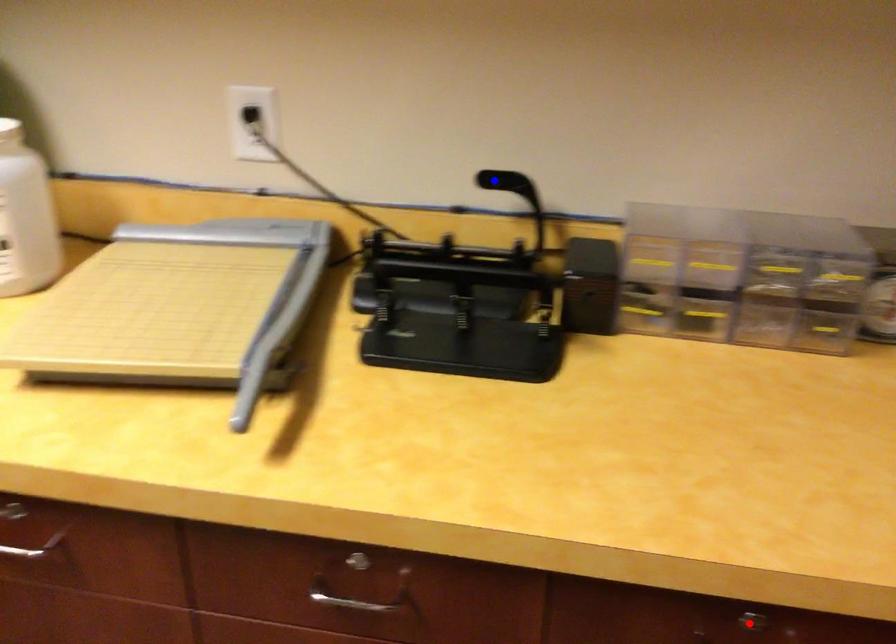
Question: Which of the two points in the image is closer to the camera?

Choices:
 (A) Blue point is closer.
 (B) Red point is closer.

Answer: (B)